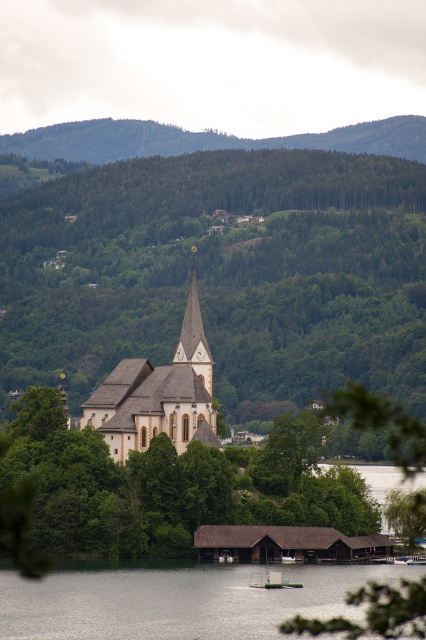
Question: Observing the image, what is the correct spatial positioning of transparent water at lower center in reference to white stone church at center?

Choices:
 (A) above
 (B) below

Answer: (B)

Question: Which of the following is the closest to the observer?

Choices:
 (A) transparent water at lower center
 (B) green leafy tree at center
 (C) white stone church at center

Answer: (A)

Question: Which of the following is the farthest from the observer?

Choices:
 (A) [417, 125]
 (B) [353, 164]

Answer: (A)

Question: Considering the relative positions of green leafy tree at center and white stone church at center in the image provided, where is green leafy tree at center located with respect to white stone church at center?

Choices:
 (A) right
 (B) left

Answer: (A)

Question: Can you confirm if green leafy tree at center is smaller than white stone church at center?

Choices:
 (A) yes
 (B) no

Answer: (B)

Question: Which object is closer to the camera taking this photo?

Choices:
 (A) green forested hillside at upper center
 (B) white stone church at center

Answer: (B)